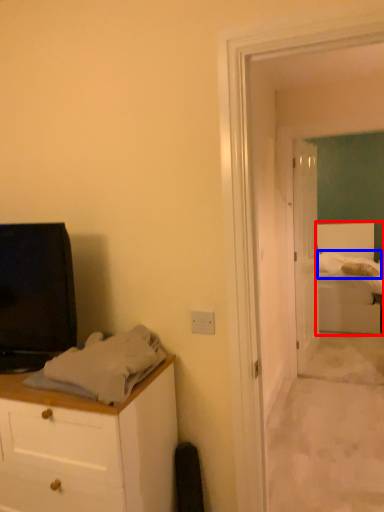
Question: Which object appears closest to the camera in this image, bed (highlighted by a red box) or sheet (highlighted by a blue box)?

Choices:
 (A) bed
 (B) sheet

Answer: (A)